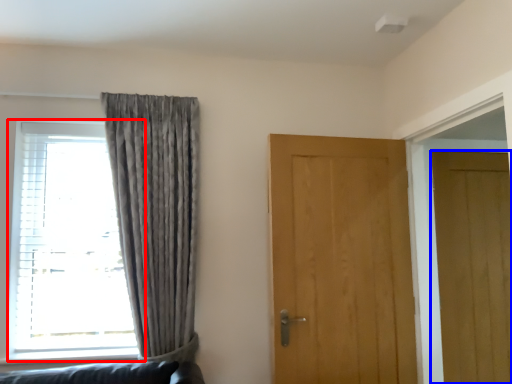
Question: Which point is closer to the camera, window (highlighted by a red box) or door (highlighted by a blue box)?

Choices:
 (A) window
 (B) door

Answer: (A)